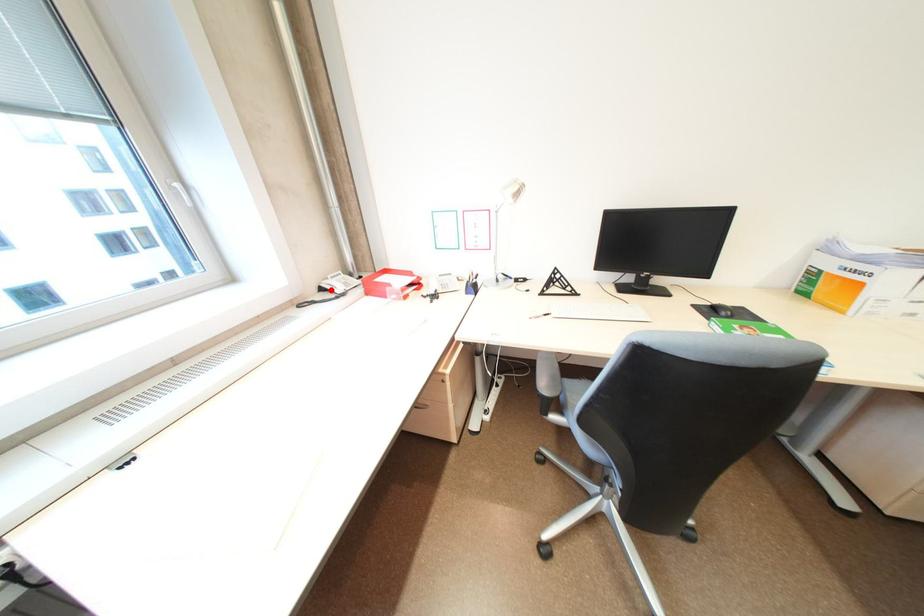
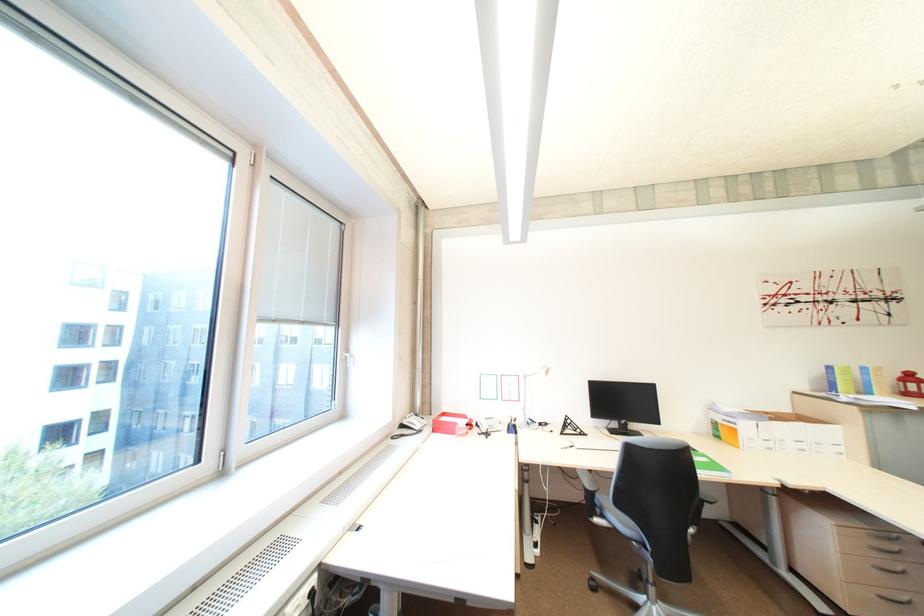
The point at the highlighted location is marked in the first image. Where is the corresponding point in the second image?

(410, 427)